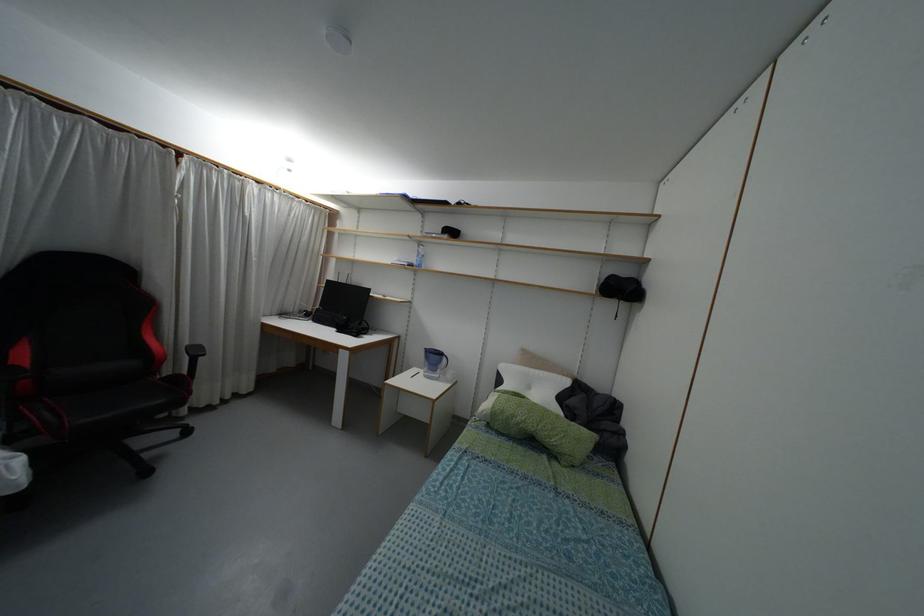
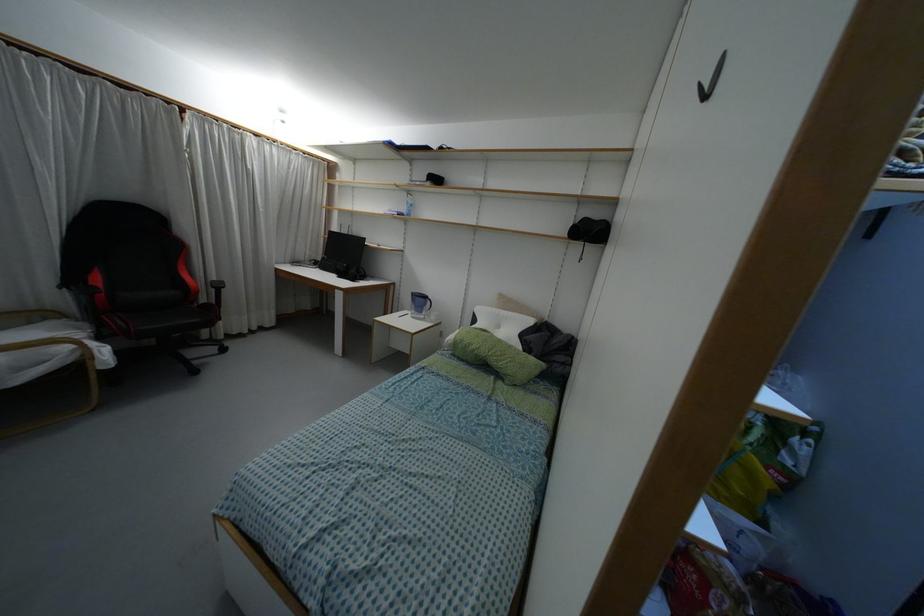
In the second image, find the point that corresponds to pixel 419 243 in the first image.

(407, 192)